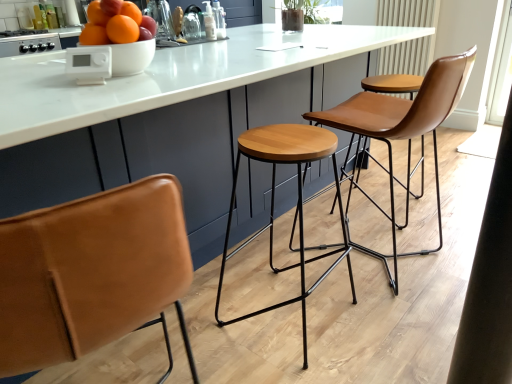
Question: From the image's perspective, would you say shiny orange fruits at upper left is positioned over white marble table at center?

Choices:
 (A) yes
 (B) no

Answer: (A)

Question: Are shiny orange fruits at upper left and white marble table at center located far from each other?

Choices:
 (A) yes
 (B) no

Answer: (B)

Question: From a real-world perspective, is shiny orange fruits at upper left located higher than white marble table at center?

Choices:
 (A) no
 (B) yes

Answer: (B)

Question: Does shiny orange fruits at upper left have a lesser height compared to white marble table at center?

Choices:
 (A) no
 (B) yes

Answer: (B)

Question: Can you confirm if shiny orange fruits at upper left is wider than white marble table at center?

Choices:
 (A) no
 (B) yes

Answer: (A)

Question: In the image, is shiny orange fruits at upper left positioned in front of or behind brown leather chair at center?

Choices:
 (A) behind
 (B) front

Answer: (B)

Question: In terms of size, does shiny orange fruits at upper left appear bigger or smaller than brown leather chair at center?

Choices:
 (A) big
 (B) small

Answer: (B)

Question: Choose the correct answer: Is shiny orange fruits at upper left inside brown leather chair at center or outside it?

Choices:
 (A) outside
 (B) inside

Answer: (A)

Question: In terms of height, does shiny orange fruits at upper left look taller or shorter compared to brown leather chair at center?

Choices:
 (A) short
 (B) tall

Answer: (A)

Question: Considering the positions of white marble table at center and shiny orange fruits at upper left in the image, is white marble table at center taller or shorter than shiny orange fruits at upper left?

Choices:
 (A) tall
 (B) short

Answer: (A)

Question: From a real-world perspective, is white marble table at center positioned above or below shiny orange fruits at upper left?

Choices:
 (A) below
 (B) above

Answer: (A)

Question: Considering the positions of point (31, 82) and point (128, 18), is point (31, 82) closer or farther from the camera than point (128, 18)?

Choices:
 (A) closer
 (B) farther

Answer: (A)

Question: From the image's perspective, is white marble table at center located above or below shiny orange fruits at upper left?

Choices:
 (A) below
 (B) above

Answer: (A)

Question: From a real-world perspective, relative to white plastic device at upper center, which is the 2th appliance in top-to-bottom order, is white matte bowl at upper center vertically above or below?

Choices:
 (A) below
 (B) above

Answer: (A)

Question: Relative to white plastic device at upper center, which is counted as the first appliance, starting from the right, is white matte bowl at upper center in front or behind?

Choices:
 (A) behind
 (B) front

Answer: (A)